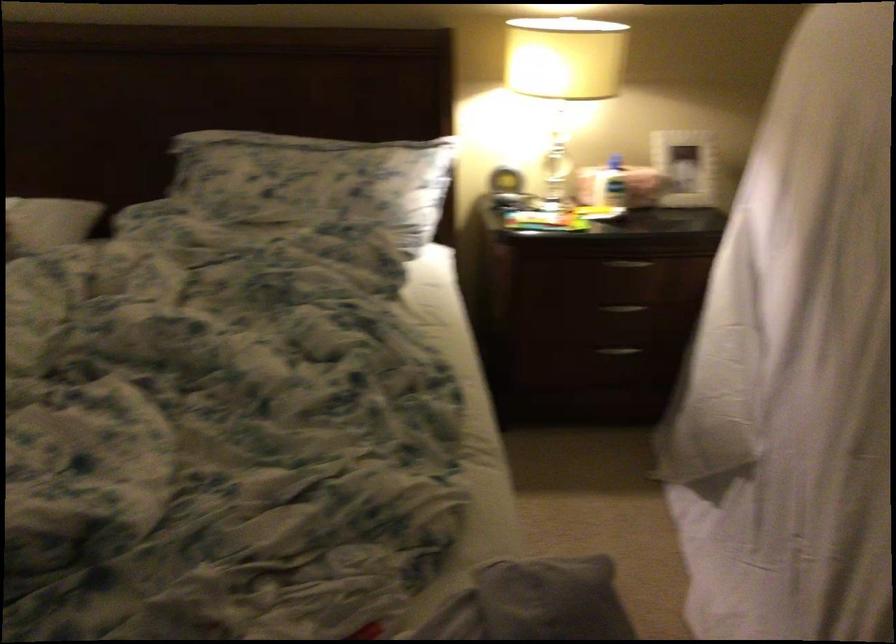
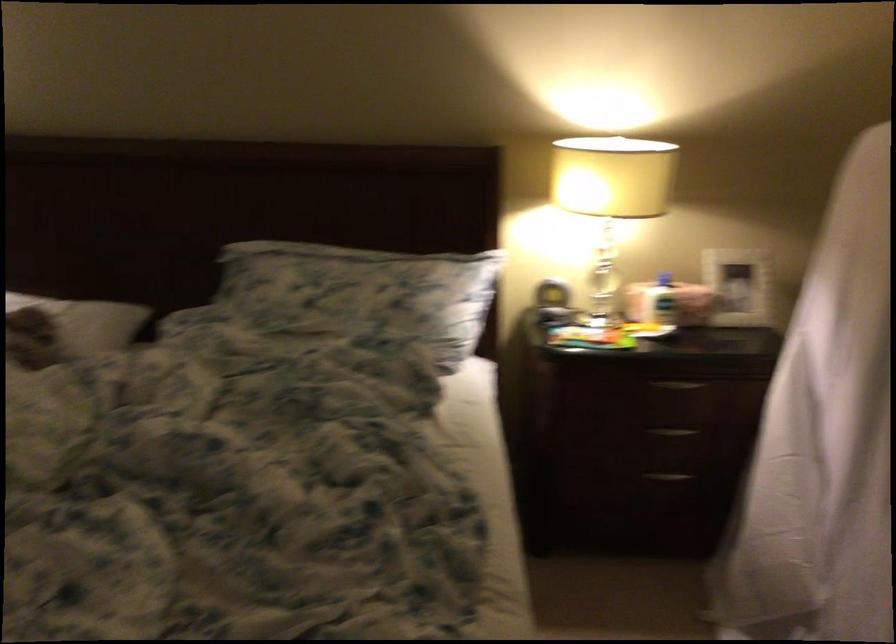
Locate, in the second image, the point that corresponds to point (682, 167) in the first image.

(737, 286)